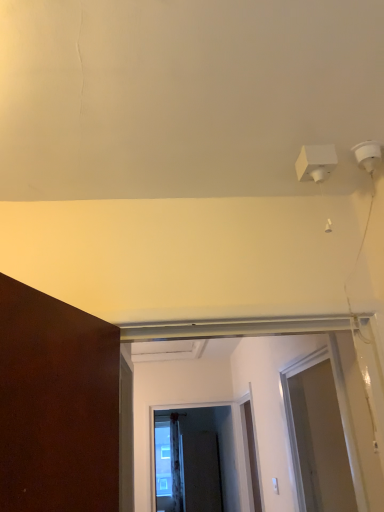
The height and width of the screenshot is (512, 384). Identify the location of black matte screen door at center, positioned as the first screen door in back-to-front order. (201, 472).

This screenshot has height=512, width=384. What are the coordinates of `white matte door at center` in the screenshot? It's located at (251, 457).

Which object is wider, clear glass screen door at center, which is the 2th screen door from front to back, or black matte screen door at center, positioned as the first screen door in back-to-front order?

black matte screen door at center, positioned as the first screen door in back-to-front order.

Is clear glass screen door at center, the second screen door viewed from the back, facing towards black matte screen door at center, which is the first screen door in bottom-to-top order?

No, clear glass screen door at center, the second screen door viewed from the back, is not aimed at black matte screen door at center, which is the first screen door in bottom-to-top order.

Which of these two, clear glass screen door at center, which appears as the second screen door when ordered from the bottom, or black matte screen door at center, arranged as the third screen door when viewed from the front, is bigger?

With larger size is black matte screen door at center, arranged as the third screen door when viewed from the front.

How much distance is there between clear glass screen door at center, which is the 2th screen door from front to back, and black matte screen door at center, positioned as the first screen door in back-to-front order?

clear glass screen door at center, which is the 2th screen door from front to back, is 6.72 inches from black matte screen door at center, positioned as the first screen door in back-to-front order.

Is black matte screen door at center, positioned as the first screen door in back-to-front order, turned away from transparent plastic screen door at right, positioned as the first screen door in top-to-bottom order?

black matte screen door at center, positioned as the first screen door in back-to-front order, is not turned away from transparent plastic screen door at right, positioned as the first screen door in top-to-bottom order.

Looking at the image, does black matte screen door at center, which is the first screen door in bottom-to-top order, seem bigger or smaller compared to transparent plastic screen door at right, the third screen door viewed from the back?

Considering their sizes, black matte screen door at center, which is the first screen door in bottom-to-top order, takes up more space than transparent plastic screen door at right, the third screen door viewed from the back.

From the image's perspective, is black matte screen door at center, which is the first screen door in bottom-to-top order, located above transparent plastic screen door at right, the first screen door when ordered from front to back?

No.

Considering the relative positions of black matte screen door at center, arranged as the third screen door when viewed from the front, and transparent plastic screen door at right, the first screen door when ordered from front to back, in the image provided, is black matte screen door at center, arranged as the third screen door when viewed from the front, to the left or to the right of transparent plastic screen door at right, the first screen door when ordered from front to back,?

In the image, black matte screen door at center, arranged as the third screen door when viewed from the front, appears on the left side of transparent plastic screen door at right, the first screen door when ordered from front to back.

From the image's perspective, is black matte screen door at center, arranged as the third screen door when viewed from the front, below clear glass screen door at center, the second screen door viewed from the back?

Yes, from the image's perspective, black matte screen door at center, arranged as the third screen door when viewed from the front, is beneath clear glass screen door at center, the second screen door viewed from the back.

Can you see black matte screen door at center, positioned as the first screen door in back-to-front order, touching clear glass screen door at center, which appears as the second screen door when ordered from the bottom?

No, black matte screen door at center, positioned as the first screen door in back-to-front order, is not next to clear glass screen door at center, which appears as the second screen door when ordered from the bottom.

Which is farther, (197, 461) or (186, 420)?

Positioned behind is point (186, 420).

Relative to clear glass screen door at center, the second screen door viewed from the back, is black matte screen door at center, acting as the 3th screen door starting from the top, in front or behind?

black matte screen door at center, acting as the 3th screen door starting from the top, is behind clear glass screen door at center, the second screen door viewed from the back.

Is point (244, 416) more distant than point (341, 425)?

Yes, point (244, 416) is behind point (341, 425).

What's the angular difference between white matte door at center and transparent plastic screen door at right, acting as the third screen door starting from the bottom,'s facing directions?

0.37 degrees separate the facing orientations of white matte door at center and transparent plastic screen door at right, acting as the third screen door starting from the bottom.

Which is more to the right, white matte door at center or transparent plastic screen door at right, the first screen door when ordered from front to back?

transparent plastic screen door at right, the first screen door when ordered from front to back, is more to the right.

Choose the correct answer: Is transparent plastic screen door at right, the first screen door when ordered from front to back, inside white matte door at center or outside it?

transparent plastic screen door at right, the first screen door when ordered from front to back, is located beyond the bounds of white matte door at center.

Is point (310, 436) positioned after point (254, 471)?

No, it is not.

Measure the distance from transparent plastic screen door at right, the third screen door viewed from the back, to white matte door at center.

They are 35.22 inches apart.

Does transparent plastic screen door at right, positioned as the first screen door in top-to-bottom order, appear on the left side of white matte door at center?

No, transparent plastic screen door at right, positioned as the first screen door in top-to-bottom order, is not to the left of white matte door at center.

Which of these two, clear glass screen door at center, which appears as the second screen door when ordered from the bottom, or transparent plastic screen door at right, the first screen door when ordered from front to back, is smaller?

clear glass screen door at center, which appears as the second screen door when ordered from the bottom.

From the image's perspective, is clear glass screen door at center, which appears as the second screen door when ordered from the bottom, above transparent plastic screen door at right, the first screen door when ordered from front to back?

No, from the image's perspective, clear glass screen door at center, which appears as the second screen door when ordered from the bottom, is not on top of transparent plastic screen door at right, the first screen door when ordered from front to back.

From the image's perspective, which is below, transparent plastic screen door at right, the third screen door viewed from the back, or black matte screen door at center, positioned as the first screen door in back-to-front order?

black matte screen door at center, positioned as the first screen door in back-to-front order, appears lower in the image.

Looking at this image, is transparent plastic screen door at right, the third screen door viewed from the back, bigger than black matte screen door at center, positioned as the first screen door in back-to-front order?

No, transparent plastic screen door at right, the third screen door viewed from the back, is not bigger than black matte screen door at center, positioned as the first screen door in back-to-front order.

This screenshot has height=512, width=384. In order to click on the 2nd screen door behind the transparent plastic screen door at right, the third screen door viewed from the back, starting your count from the anchor in this screenshot , I will do `click(201, 472)`.

Can you see transparent plastic screen door at right, the first screen door when ordered from front to back, touching black matte screen door at center, arranged as the third screen door when viewed from the front?

They are not placed beside each other.

The image size is (384, 512). What are the coordinates of `screen door located underneath the clear glass screen door at center, which appears as the second screen door when ordered from the bottom (from a real-world perspective)` in the screenshot? It's located at (201, 472).

From the black matte screen door at center, acting as the 3th screen door starting from the top, count 2nd screen doors forward and point to it. Please provide its 2D coordinates.

[(317, 441)]

From the image, which object appears to be nearer to black matte screen door at center, which is the first screen door in bottom-to-top order, white matte door at center or clear glass screen door at center, which is the 2th screen door from front to back?

clear glass screen door at center, which is the 2th screen door from front to back, is positioned closer to the anchor black matte screen door at center, which is the first screen door in bottom-to-top order.

Based on their spatial positions, is clear glass screen door at center, which is the 2th screen door from front to back, or white matte door at center further from transparent plastic screen door at right, positioned as the first screen door in top-to-bottom order?

Based on the image, clear glass screen door at center, which is the 2th screen door from front to back, appears to be further to transparent plastic screen door at right, positioned as the first screen door in top-to-bottom order.

Estimate the real-world distances between objects in this image. Which object is closer to white matte door at center, transparent plastic screen door at right, acting as the third screen door starting from the bottom, or black matte screen door at center, acting as the 3th screen door starting from the top?

transparent plastic screen door at right, acting as the third screen door starting from the bottom, lies closer to white matte door at center than the other object.

Which object lies nearer to the anchor point black matte screen door at center, which is the first screen door in bottom-to-top order, clear glass screen door at center, which appears as the second screen door when ordered from the bottom, or white matte door at center?

clear glass screen door at center, which appears as the second screen door when ordered from the bottom, is positioned closer to the anchor black matte screen door at center, which is the first screen door in bottom-to-top order.

From the image, which object appears to be farther from transparent plastic screen door at right, the third screen door viewed from the back, white matte door at center or black matte screen door at center, which is the first screen door in bottom-to-top order?

black matte screen door at center, which is the first screen door in bottom-to-top order, is positioned further to the anchor transparent plastic screen door at right, the third screen door viewed from the back.

When comparing their distances from black matte screen door at center, positioned as the first screen door in back-to-front order, does transparent plastic screen door at right, acting as the third screen door starting from the bottom, or white matte door at center seem further?

transparent plastic screen door at right, acting as the third screen door starting from the bottom.

Considering their positions, is transparent plastic screen door at right, the third screen door viewed from the back, positioned closer to white matte door at center than clear glass screen door at center, which appears as the second screen door when ordered from the bottom?

transparent plastic screen door at right, the third screen door viewed from the back, is positioned closer to the anchor white matte door at center.

Based on their spatial positions, is white matte door at center or black matte screen door at center, which is the first screen door in bottom-to-top order, closer to clear glass screen door at center, the second screen door viewed from the back?

black matte screen door at center, which is the first screen door in bottom-to-top order, is closer to clear glass screen door at center, the second screen door viewed from the back.

You are a GUI agent. You are given a task and a screenshot of the screen. Output one action in this format:
    pyautogui.click(x=<x>, y=<y>)
    Task: Click on the door between transparent plastic screen door at right, the first screen door when ordered from front to back, and clear glass screen door at center, which appears as the second screen door when ordered from the bottom, along the z-axis
    Image resolution: width=384 pixels, height=512 pixels.
    Given the screenshot: What is the action you would take?
    pyautogui.click(x=251, y=457)

Image resolution: width=384 pixels, height=512 pixels. I want to click on screen door between white matte door at center and black matte screen door at center, positioned as the first screen door in back-to-front order, from front to back, so click(217, 446).

Where is `screen door between transparent plastic screen door at right, the third screen door viewed from the back, and black matte screen door at center, acting as the 3th screen door starting from the top, from front to back`? Image resolution: width=384 pixels, height=512 pixels. screen door between transparent plastic screen door at right, the third screen door viewed from the back, and black matte screen door at center, acting as the 3th screen door starting from the top, from front to back is located at coordinates (217, 446).

What are the coordinates of `door between transparent plastic screen door at right, the third screen door viewed from the back, and black matte screen door at center, positioned as the first screen door in back-to-front order, along the z-axis` in the screenshot? It's located at (251, 457).